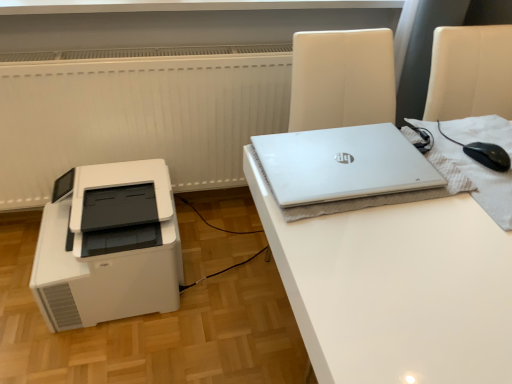
What are the coordinates of `blank space situated above silver metallic laptop at upper right (from a real-world perspective)` in the screenshot? It's located at (336, 163).